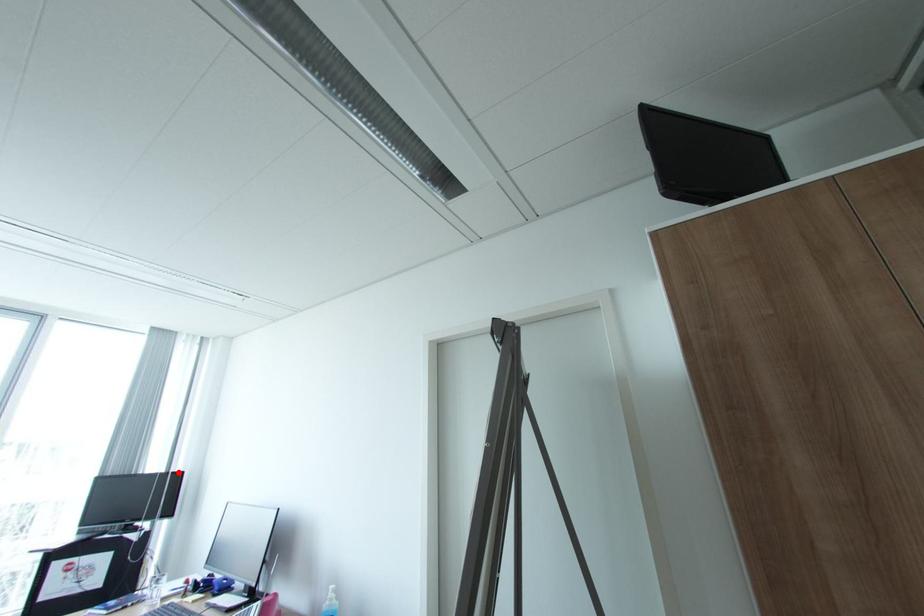
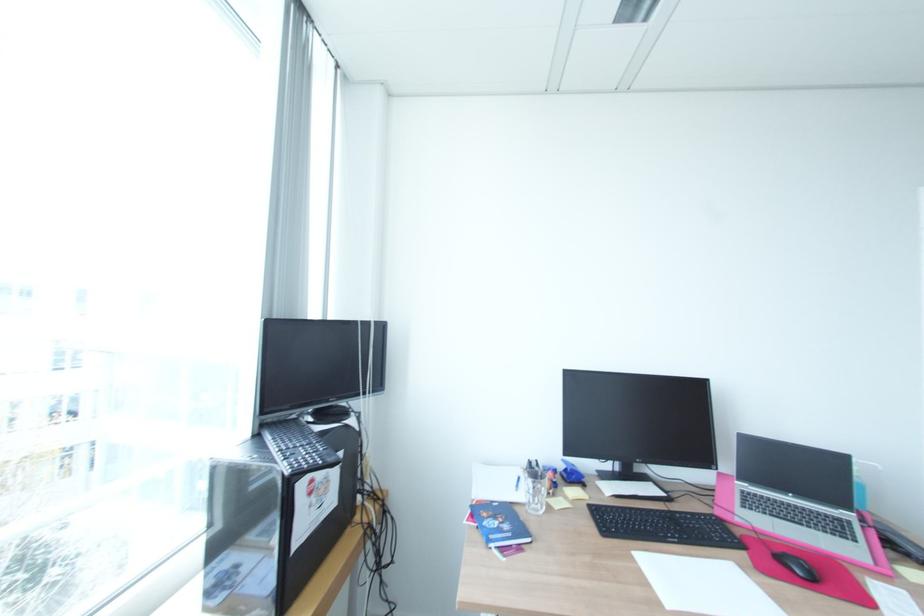
Question: I am providing you with two images of the same scene from different viewpoints. A red point is marked on the first image. Can you still see the location of the red point in image 2?

Choices:
 (A) Yes
 (B) No

Answer: (A)